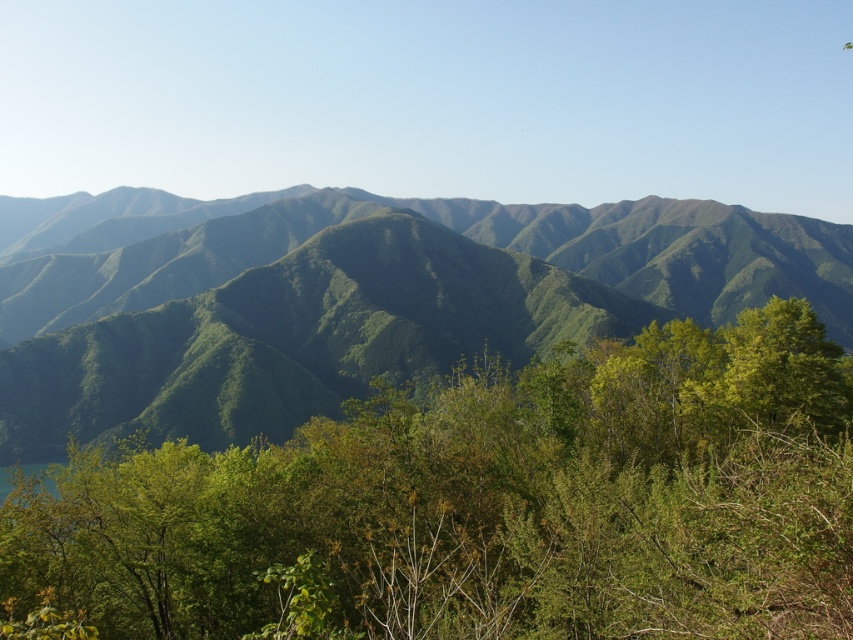
You are a hiker who wants to take a photo of the green leafy tree at center and the green textured mountains at center. Which object should you focus on first if you want to capture both in a single frame without moving the camera?

You should focus on the green textured mountains at center first because they are taller than the green leafy tree at center, allowing both to be in the frame when positioned properly.

You are a hiker standing at the bottom of the mountain. You see the green leafy tree at center in the distance. Based on its position, can you estimate where it is located relative to your current position?

The green leafy tree at center is located at coordinates approximately 0.791 along the horizontal axis and 0.565 along the vertical axis from your current position at the bottom of the mountain.